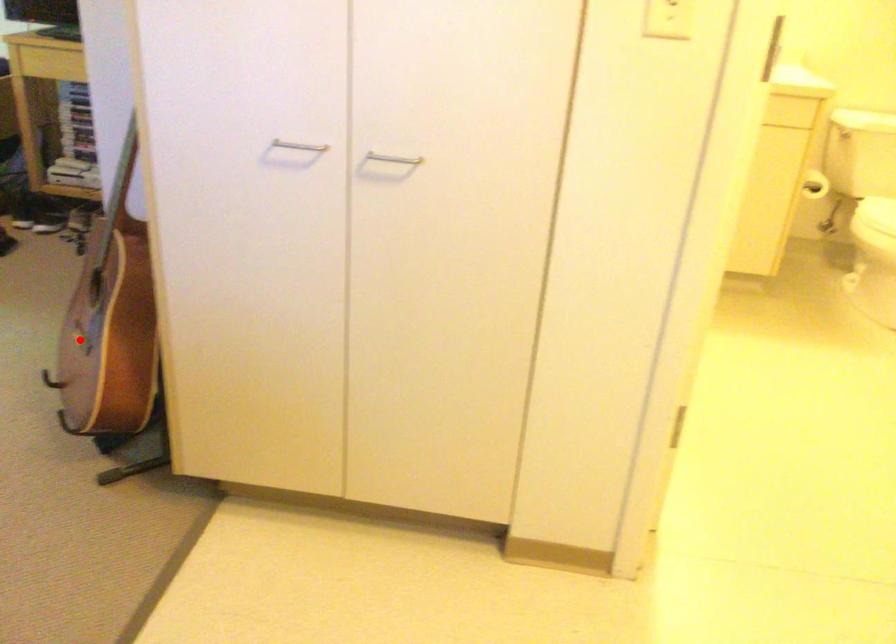
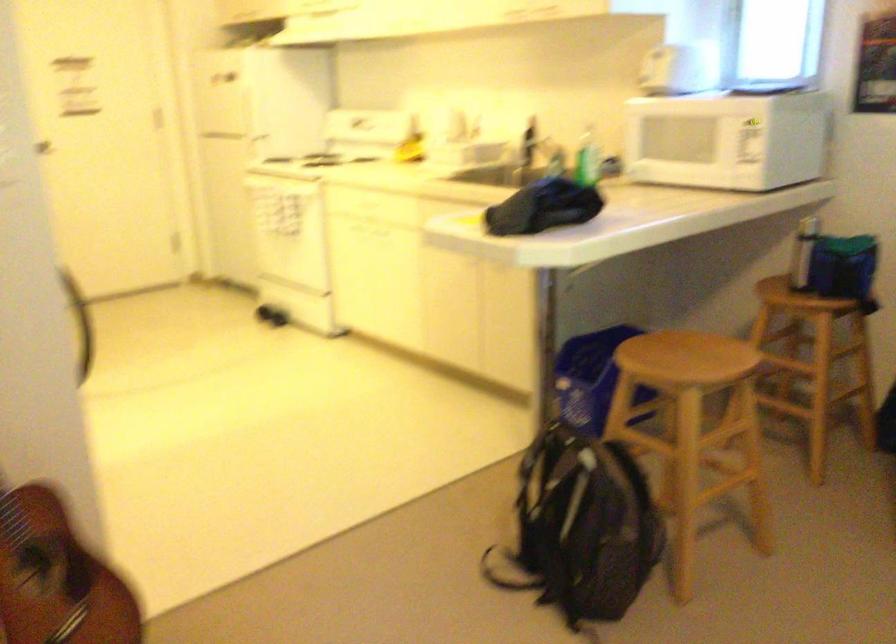
Question: I am providing you with two images of the same scene from different viewpoints. A red point is shown in image1. For the corresponding object point in image2, is it positioned nearer or farther from the camera?

Choices:
 (A) Nearer
 (B) Farther

Answer: (A)